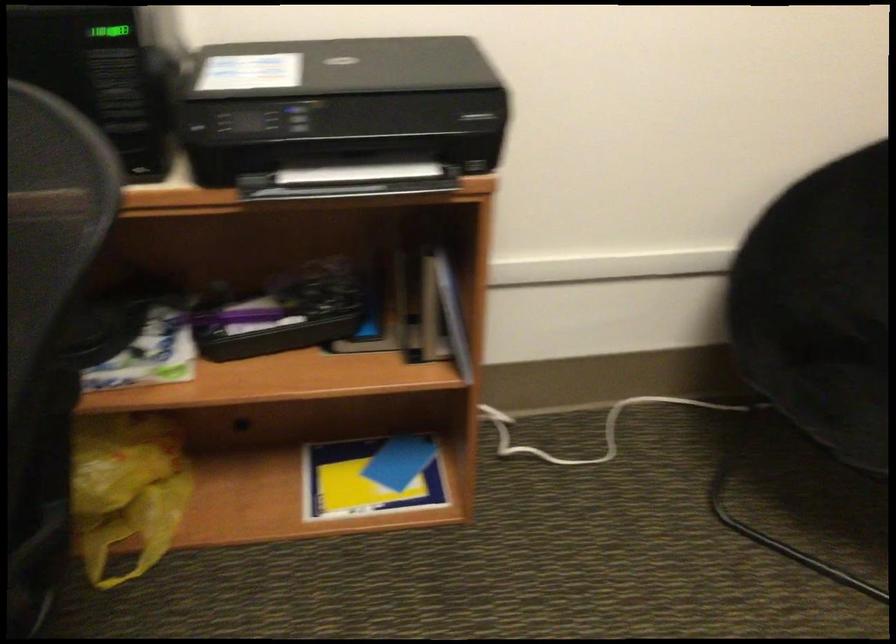
Image resolution: width=896 pixels, height=644 pixels. What do you see at coordinates (149, 355) in the screenshot?
I see `the package of tissues` at bounding box center [149, 355].